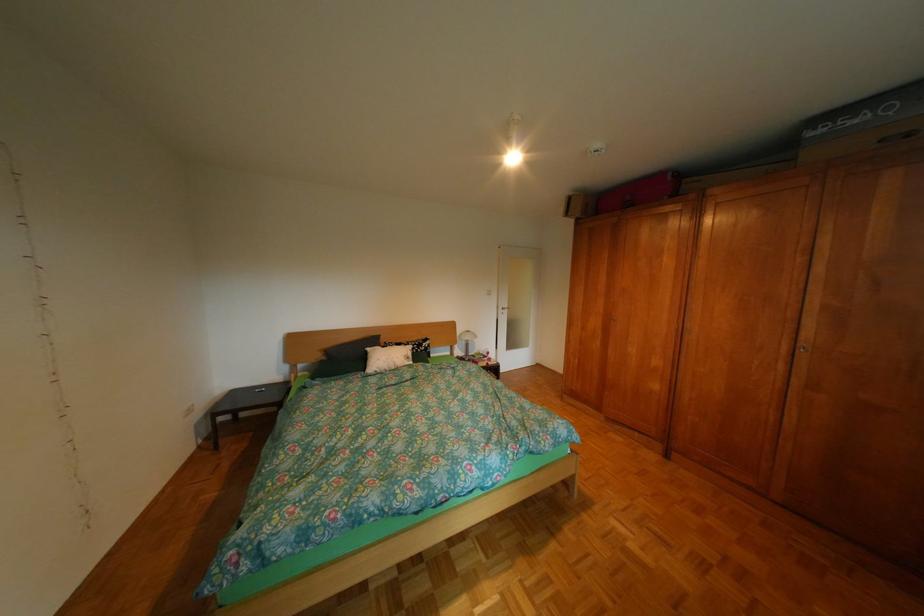
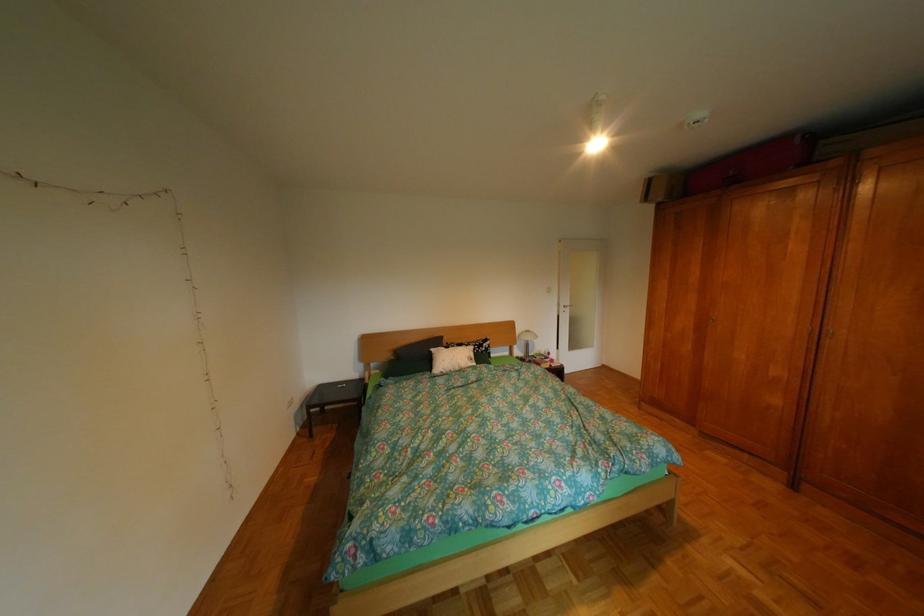
Question: In a continuous first-person perspective shot, in which direction is the camera moving?

Choices:
 (A) Left
 (B) Right
 (C) Forward
 (D) Backward

Answer: (A)